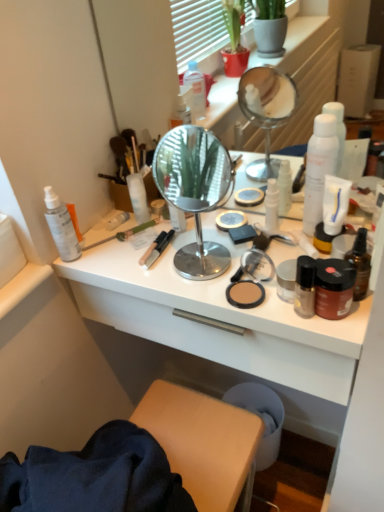
Image resolution: width=384 pixels, height=512 pixels. Find the location of `vacant space that is to the left of brown glass bottle at right, which is counted as the second bottle, starting from the back`. vacant space that is to the left of brown glass bottle at right, which is counted as the second bottle, starting from the back is located at coordinates (251, 295).